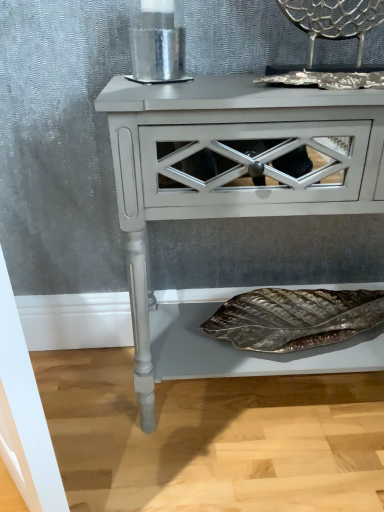
The width and height of the screenshot is (384, 512). What do you see at coordinates (232, 168) in the screenshot? I see `matte white nightstand at center` at bounding box center [232, 168].

Where is `matte white nightstand at center`? This screenshot has height=512, width=384. matte white nightstand at center is located at coordinates tap(232, 168).

Locate an element on the screen. metallic silver chair at upper right is located at coordinates pos(334,20).

Describe the element at coordinates (334, 20) in the screenshot. The height and width of the screenshot is (512, 384). I see `metallic silver chair at upper right` at that location.

Locate an element on the screen. matte white nightstand at center is located at coordinates coord(232,168).

Which object is positioned more to the right, matte white nightstand at center or metallic silver chair at upper right?

metallic silver chair at upper right is more to the right.

Considering the positions of objects matte white nightstand at center and metallic silver chair at upper right in the image provided, who is behind, matte white nightstand at center or metallic silver chair at upper right?

metallic silver chair at upper right is further from the camera.

Which is behind, point (151, 152) or point (321, 5)?

Positioned behind is point (321, 5).

From the image's perspective, is matte white nightstand at center above or below metallic silver chair at upper right?

matte white nightstand at center is situated lower than metallic silver chair at upper right in the image.

From a real-world perspective, is matte white nightstand at center physically located above or below metallic silver chair at upper right?

In terms of real-world spatial position, matte white nightstand at center is below metallic silver chair at upper right.

Is matte white nightstand at center thinner than metallic silver chair at upper right?

No, matte white nightstand at center is not thinner than metallic silver chair at upper right.

Can you confirm if matte white nightstand at center is shorter than metallic silver chair at upper right?

Incorrect, the height of matte white nightstand at center does not fall short of that of metallic silver chair at upper right.

Looking at this image, can you confirm if matte white nightstand at center is smaller than metallic silver chair at upper right?

No, matte white nightstand at center is not smaller than metallic silver chair at upper right.

Would you say matte white nightstand at center is inside or outside metallic silver chair at upper right?

matte white nightstand at center is spatially situated outside metallic silver chair at upper right.

Is matte white nightstand at center directly adjacent to metallic silver chair at upper right?

No, matte white nightstand at center is not with metallic silver chair at upper right.

Could you tell me if matte white nightstand at center is facing metallic silver chair at upper right?

No, matte white nightstand at center is not aimed at metallic silver chair at upper right.

Can you tell me how much matte white nightstand at center and metallic silver chair at upper right differ in facing direction?

0.000901 degrees.

Image resolution: width=384 pixels, height=512 pixels. I want to click on nightstand that is under the metallic silver chair at upper right (from a real-world perspective), so click(x=232, y=168).

Is metallic silver chair at upper right at the right side of matte white nightstand at center?

Indeed, metallic silver chair at upper right is positioned on the right side of matte white nightstand at center.

Is metallic silver chair at upper right behind matte white nightstand at center?

That is True.

Is point (324, 27) closer or farther from the camera than point (355, 105)?

Point (324, 27) is farther from the camera than point (355, 105).

From the image's perspective, is metallic silver chair at upper right below matte white nightstand at center?

Incorrect, from the image's perspective, metallic silver chair at upper right is higher than matte white nightstand at center.

From a real-world perspective, does metallic silver chair at upper right stand above matte white nightstand at center?

Yes, from a real-world perspective, metallic silver chair at upper right is over matte white nightstand at center

Which object is wider, metallic silver chair at upper right or matte white nightstand at center?

Wider between the two is matte white nightstand at center.

Based on the photo, considering the sizes of objects metallic silver chair at upper right and matte white nightstand at center in the image provided, who is taller, metallic silver chair at upper right or matte white nightstand at center?

matte white nightstand at center.

Based on their sizes in the image, would you say metallic silver chair at upper right is bigger or smaller than matte white nightstand at center?

Clearly, metallic silver chair at upper right is smaller in size than matte white nightstand at center.

Is matte white nightstand at center inside metallic silver chair at upper right?

No, matte white nightstand at center is not a part of metallic silver chair at upper right.

Is metallic silver chair at upper right far from matte white nightstand at center?

No, metallic silver chair at upper right is not far from matte white nightstand at center.

Is metallic silver chair at upper right facing towards matte white nightstand at center?

No, metallic silver chair at upper right is not facing towards matte white nightstand at center.

The width and height of the screenshot is (384, 512). In the image, there is a matte white nightstand at center. Identify the location of chair above it (from the image's perspective). (334, 20).

At what (x,y) coordinates should I click in order to perform the action: click on chair behind the matte white nightstand at center. Please return your answer as a coordinate pair (x, y). The image size is (384, 512). Looking at the image, I should click on (334, 20).

Find the location of a particular element. nightstand located underneath the metallic silver chair at upper right (from a real-world perspective) is located at coordinates (232, 168).